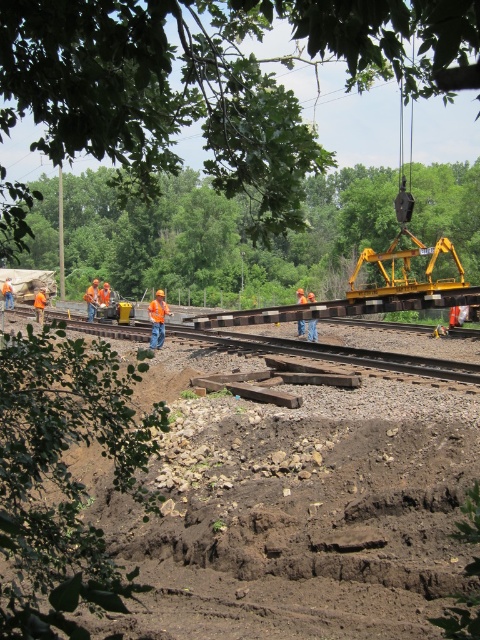
You are a safety inspector at the construction site. You need to check the safety of the brown wooden track at center and the orange reflective vest at left. According to the scene description, which object is positioned lower in the image?

The brown wooden track at center is located below orange reflective vest at left, so the brown wooden track at center is positioned lower in the image.

You are a construction supervisor checking the railway site. You need to place a new sign that must be larger than the brown dirt at center. Can the sign be placed next to the yellow metallic crane at right without exceeding its size?

The brown dirt at center has a smaller size compared to the yellow metallic crane at right. Since the sign needs to be larger than the brown dirt, it can be placed next to the yellow metallic crane at right as the crane is larger in size and the sign would fit within the available space.

You are a safety inspector checking the equipment in the construction area. You notice an orange hard hat at left and an orange reflective vest at left. Which piece of equipment is bigger in size?

The orange hard hat at left has a larger size compared to the orange reflective vest at left.